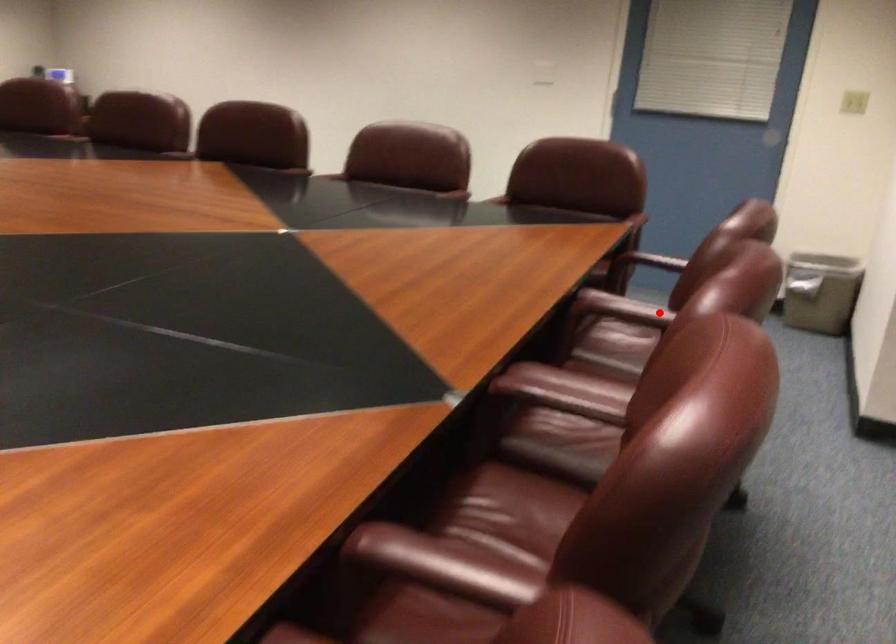
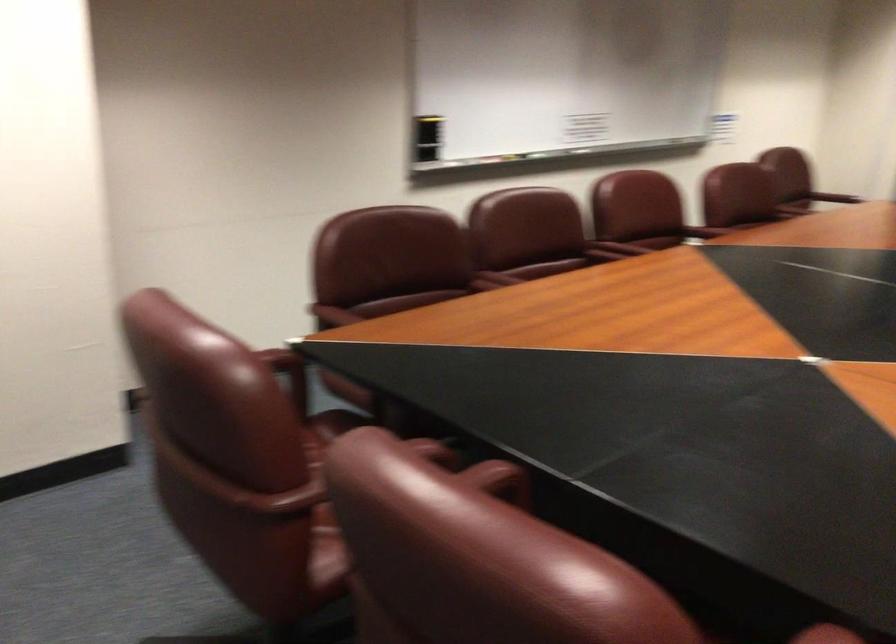
Question: A red point is marked in image1. In image2, is the corresponding 3D point closer to the camera or farther? Reply with the corresponding letter.

Choices:
 (A) The corresponding 3D point is closer.
 (B) The corresponding 3D point is farther.

Answer: (B)